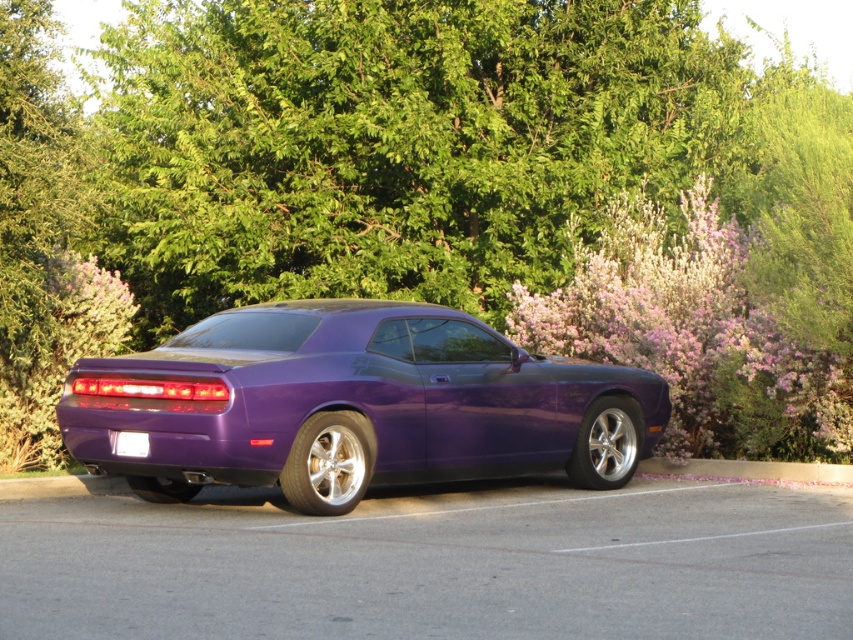
Between green leafy tree at upper center and glossy purple car at center, which one has less height?

With less height is green leafy tree at upper center.

Between point (500, 260) and point (235, 388), which one is positioned behind?

The point (500, 260) is behind.

Find the location of `green leafy tree at upper center`. green leafy tree at upper center is located at coordinates (392, 141).

Is the position of green leafy tree at upper center less distant than that of pink fluffy bush at right?

No, it is not.

Between point (114, 32) and point (664, 243), which one is positioned behind?

The point (114, 32) is behind.

The image size is (853, 640). What are the coordinates of `green leafy tree at upper center` in the screenshot? It's located at (392, 141).

Is smooth asphalt at lower center bigger than glossy purple car at center?

Actually, smooth asphalt at lower center might be smaller than glossy purple car at center.

Who is higher up, smooth asphalt at lower center or glossy purple car at center?

glossy purple car at center is higher up.

The image size is (853, 640). What do you see at coordinates (434, 563) in the screenshot?
I see `smooth asphalt at lower center` at bounding box center [434, 563].

Image resolution: width=853 pixels, height=640 pixels. What are the coordinates of `smooth asphalt at lower center` in the screenshot? It's located at (434, 563).